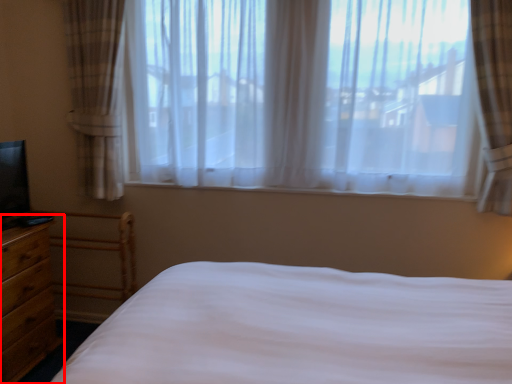
Question: From the image's perspective, what is the correct spatial relationship of nightstand (annotated by the red box) in relation to window?

Choices:
 (A) above
 (B) below

Answer: (B)